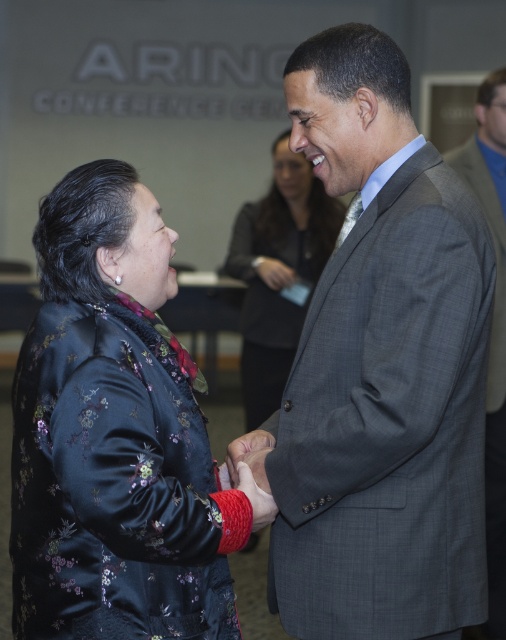
Between silky black blouse at center and gray plaid suit at center, which one is positioned higher?

silky black blouse at center

Is silky black blouse at center bigger than gray plaid suit at center?

Indeed, silky black blouse at center has a larger size compared to gray plaid suit at center.

This screenshot has height=640, width=506. I want to click on silky black blouse at center, so click(278, 272).

Between point (361, 160) and point (110, 433), which one is positioned behind?

The point (361, 160) is more distant.

Between gray textured suit at center and satin floral jacket at left, which one has less height?

Standing shorter between the two is satin floral jacket at left.

Which is in front, point (344, 337) or point (118, 180)?

Positioned in front is point (118, 180).

The height and width of the screenshot is (640, 506). I want to click on gray textured suit at center, so click(x=380, y=371).

Is satin floral jacket at left to the right of gray plaid suit at center from the viewer's perspective?

In fact, satin floral jacket at left is to the left of gray plaid suit at center.

Does satin floral jacket at left have a larger size compared to gray plaid suit at center?

Incorrect, satin floral jacket at left is not larger than gray plaid suit at center.

Who is more forward, (119, 484) or (482, 104)?

Positioned in front is point (119, 484).

Identify the location of satin floral jacket at left. This screenshot has width=506, height=640. (113, 435).